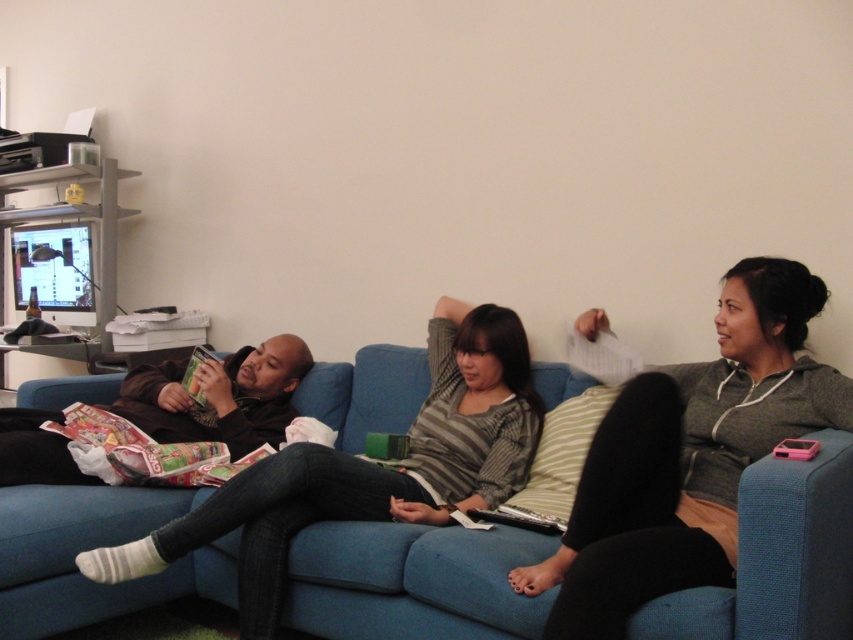
You are a photographer taking a photo of the striped sweater at center and the matte green magazine at center. Which object should you focus on first if you want to capture both clearly in the same frame?

The striped sweater at center is below the matte green magazine at center, so you should focus on the matte green magazine at center first to ensure both are in focus since it is closer to the camera.

In the scene described, there are two people wearing jackets. One has a gray fleece hoodie at right and the other has a matte brown jacket at center. Which jacket is positioned to the right of the other?

The gray fleece hoodie at right is positioned to the right of the matte brown jacket at center.